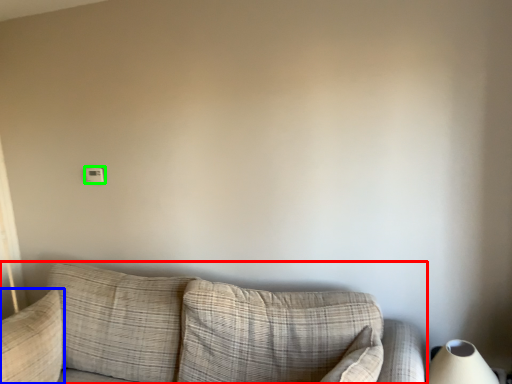
Question: Which is nearer to the studio couch (highlighted by a red box)? pillow (highlighted by a blue box) or light switch (highlighted by a green box).

Choices:
 (A) pillow
 (B) light switch

Answer: (A)